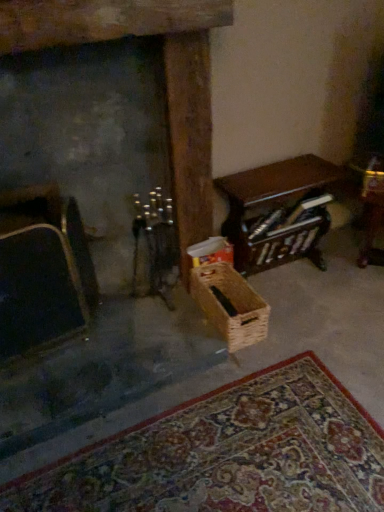
The image size is (384, 512). I want to click on free point to the right of velvet black armchair at left, so click(113, 351).